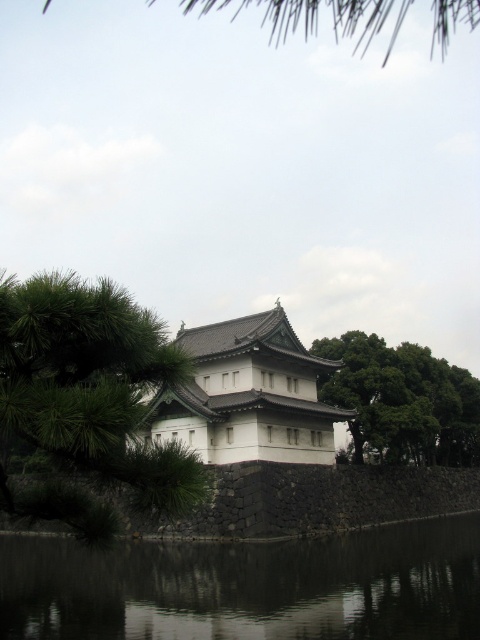
You are standing at the entrance of the traditional Japanese building and see two points marked in the image. The first point is at coordinate point (73, 360) and the second is at point (315, 392). Which point is closer to you?

Point (73, 360) is in front of point (315, 392), so the first point is closer to you.

In the scene shown: You are standing in front of a traditional Japanese building near a moat. You want to place a small decorative stone at the exact center of the black reflective water at lower center. Where should you place it?

The exact center of the black reflective water at lower center is located at coordinates point (x=249, y=586), so you should place the small decorative stone there.